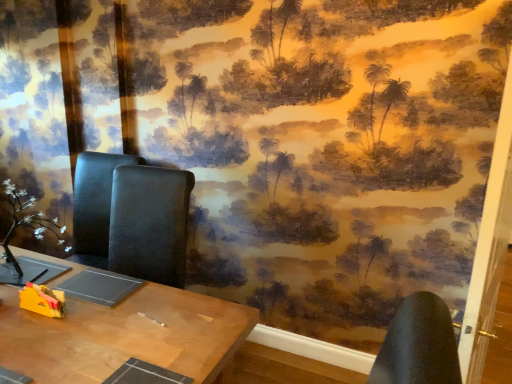
Find the location of a particular element. The width and height of the screenshot is (512, 384). free location to the left of yellow plastic toy at lower left is located at coordinates (13, 307).